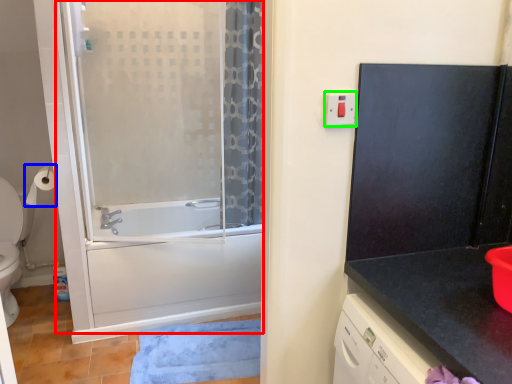
Question: Which object is positioned farthest from screen door (highlighted by a red box)? Select from toilet paper (highlighted by a blue box) and electric outlet (highlighted by a green box).

Choices:
 (A) toilet paper
 (B) electric outlet

Answer: (B)